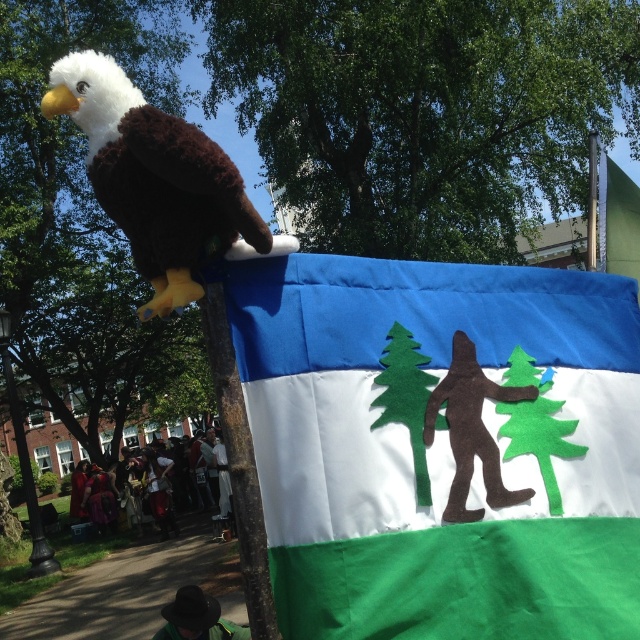
You are standing in front of the banner and notice two points marked on it. Which point is closer to you, point (241, 333) or point (120, 144)?

Point (241, 333) is further to the viewer than point (120, 144), so point (120, 144) is closer to you.